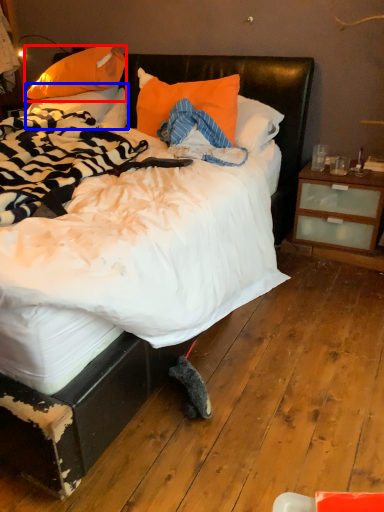
Question: Among these objects, which one is farthest to the camera, pillow (highlighted by a red box) or pillow (highlighted by a blue box)?

Choices:
 (A) pillow
 (B) pillow

Answer: (B)